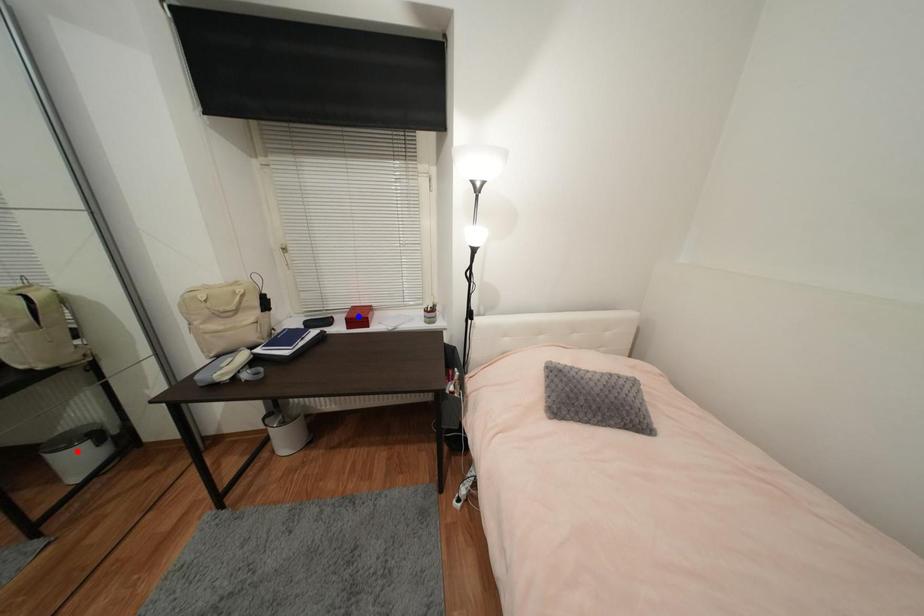
Question: Which of the two points in the image is closer to the camera?

Choices:
 (A) Blue point is closer.
 (B) Red point is closer.

Answer: (B)